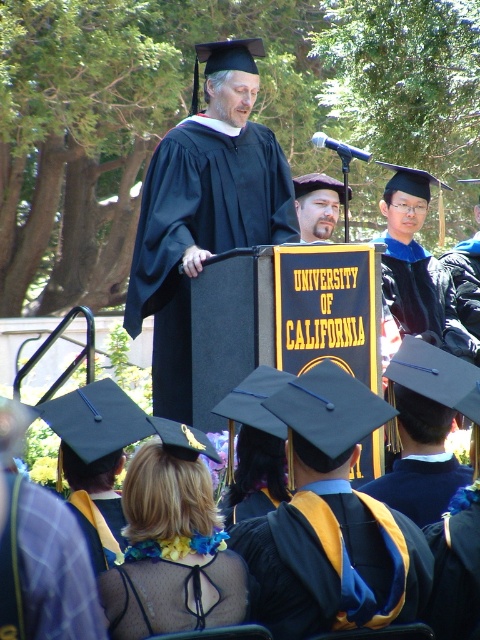
You are a photographer taking a picture of the graduation ceremony. You notice two points marked as point 1 and point 2 in the image. Point 1 is at coordinate (266, 148) and point 2 is at coordinate (240, 570). Which point is closer to the camera?

Point 1 at coordinate (266, 148) is closer to the camera than point 2 at coordinate (240, 570) because it is further to the camera.

You are a photographer at the graduation ceremony and want to capture a photo of the person at point [333,563]. Based on the scene description, what is the person wearing?

The person at point [333,563] is wearing a black matte graduation gown at center.

You are a photographer at the graduation ceremony. You need to capture a photo that includes both the matte black gown at center and the black mesh dress at center. Which object should you focus on first to ensure both are in frame?

The matte black gown at center is bigger than the black mesh dress at center, so you should focus on the matte black gown at center first to ensure both are in frame.